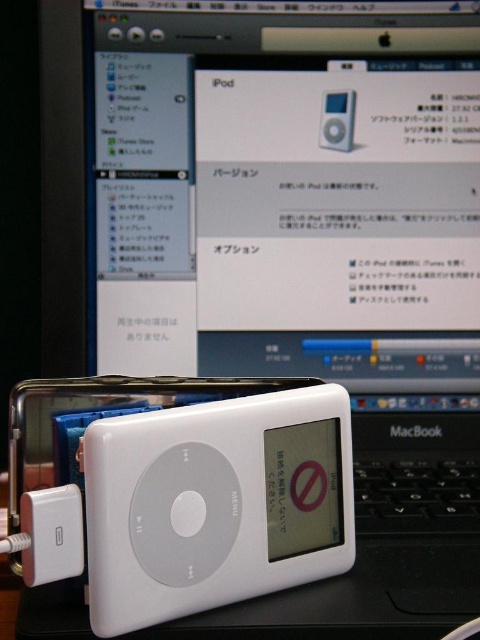
Which is in front, point (118, 515) or point (351, 132)?

Positioned in front is point (118, 515).

Where is `white glossy ipod at center`? This screenshot has width=480, height=640. white glossy ipod at center is located at coordinates (216, 502).

Between point (278, 497) and point (337, 116), which one is positioned behind?

The point (337, 116) is behind.

Locate an element on the screen. The height and width of the screenshot is (640, 480). white glossy ipod at center is located at coordinates (216, 502).

Is white plastic ipod at lower left bigger than white plastic ipod at center?

Yes.

Can you confirm if white plastic ipod at lower left is positioned to the left of white plastic ipod at center?

Indeed, white plastic ipod at lower left is positioned on the left side of white plastic ipod at center.

Which is behind, point (63, 561) or point (338, 132)?

Positioned behind is point (338, 132).

The height and width of the screenshot is (640, 480). I want to click on white plastic ipod at lower left, so click(51, 534).

Between point (119, 518) and point (34, 577), which one is positioned in front?

Point (34, 577) is in front.

In the scene shown: Does white glossy ipod at center appear on the left side of white plastic ipod at lower left?

In fact, white glossy ipod at center is to the right of white plastic ipod at lower left.

Is point (225, 589) positioned before point (82, 561)?

That is False.

Where is `white glossy ipod at center`? This screenshot has height=640, width=480. white glossy ipod at center is located at coordinates (216, 502).